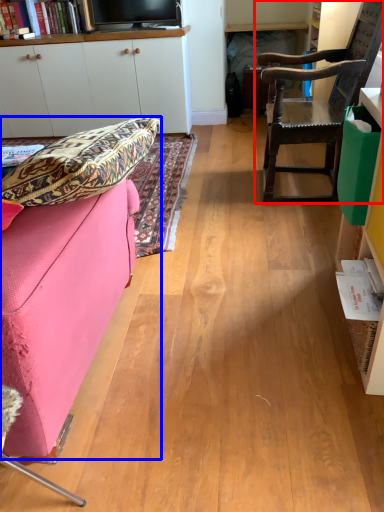
Question: Which point is further to the camera, chair (highlighted by a red box) or studio couch (highlighted by a blue box)?

Choices:
 (A) chair
 (B) studio couch

Answer: (A)